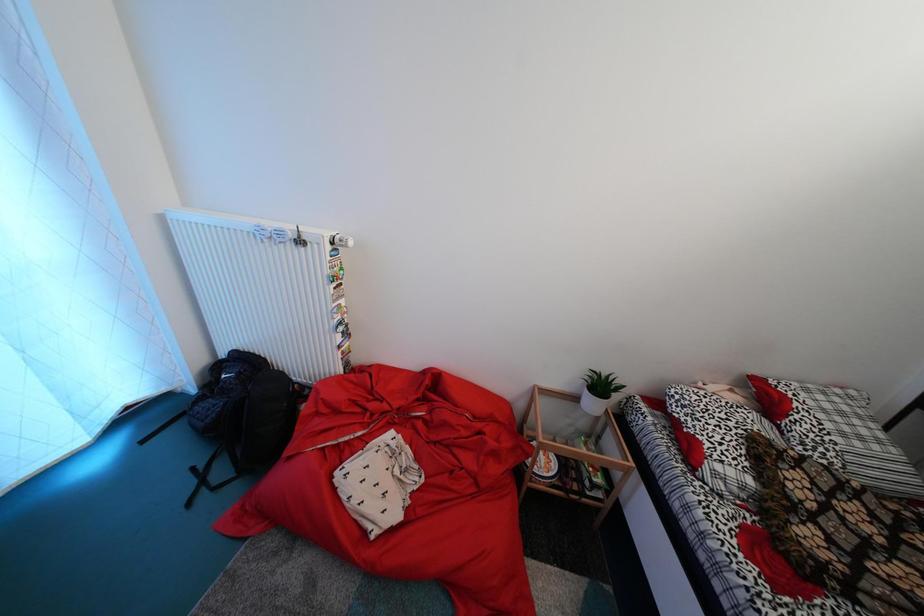
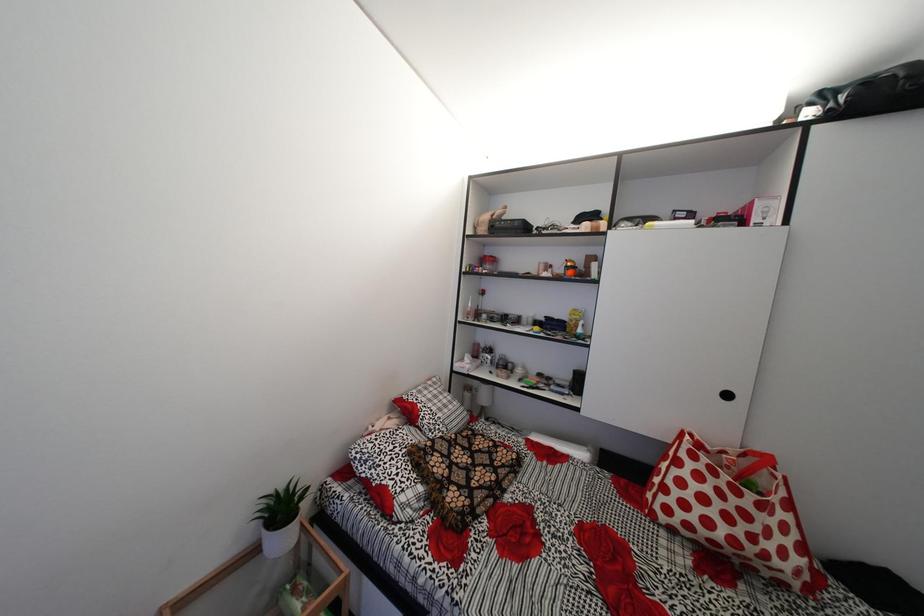
Question: The first image is from the beginning of the video and the second image is from the end. How did the camera likely rotate when shooting the video?

Choices:
 (A) Left
 (B) Right
 (C) Up
 (D) Down

Answer: (B)